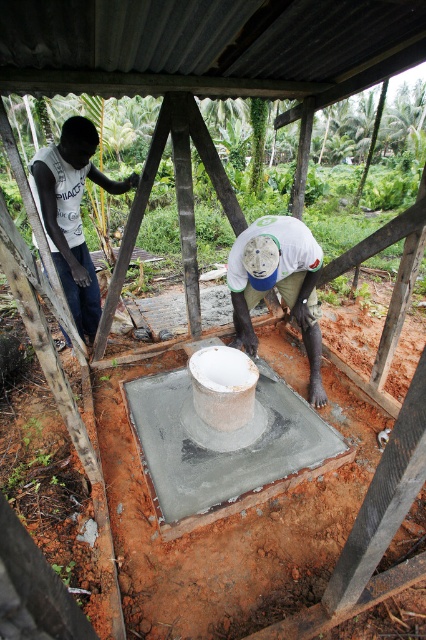
You are a construction worker standing at the entrance of the shelter. You need to place a 1.2 meter tall tool box between the matte white shirt at left and the white matte concrete at center. Can you do this without the box touching either object?

The matte white shirt at left is taller than the white matte concrete at center. Since the tool box is 1.2 meters tall, it can be placed between them as long as there is enough vertical space between their heights. However, the description does not provide information about the horizontal distance between the objects, so we cannot confirm if the box will fit without touching either object.

You are standing at point (261, 225) and want to move to the shelter. Is point (51, 211) behind you or in front of you?

Point (51, 211) is behind point (261, 225), so it is behind you.